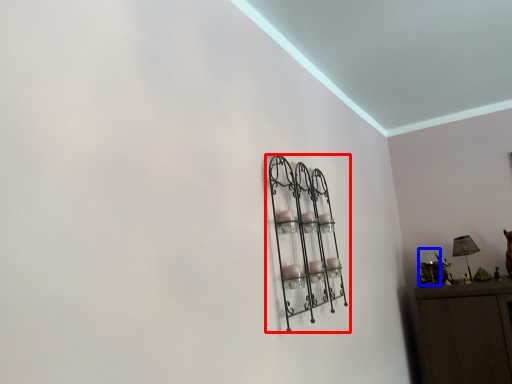
Question: Which of the following is the farthest to the observer, shelf (highlighted by a red box) or lamp (highlighted by a blue box)?

Choices:
 (A) shelf
 (B) lamp

Answer: (B)